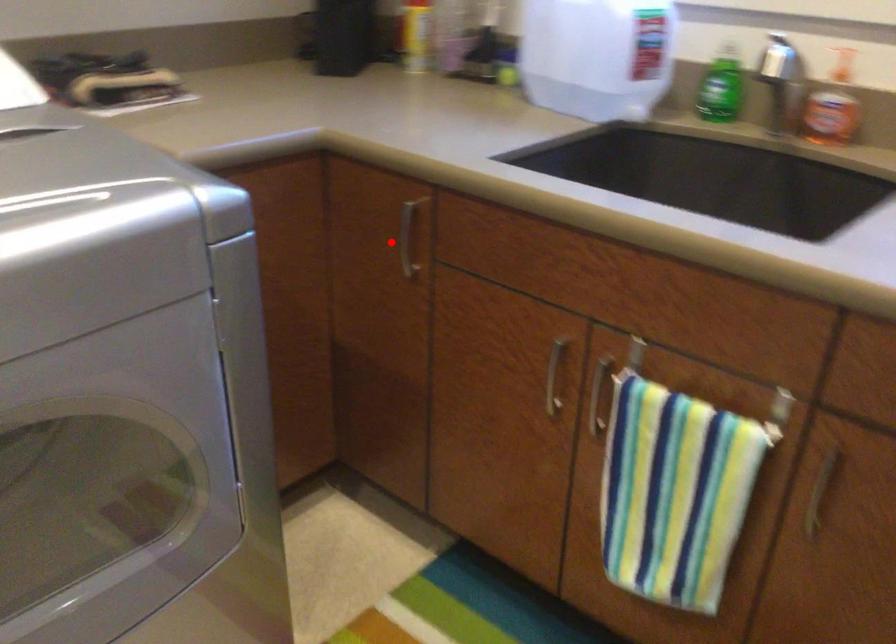
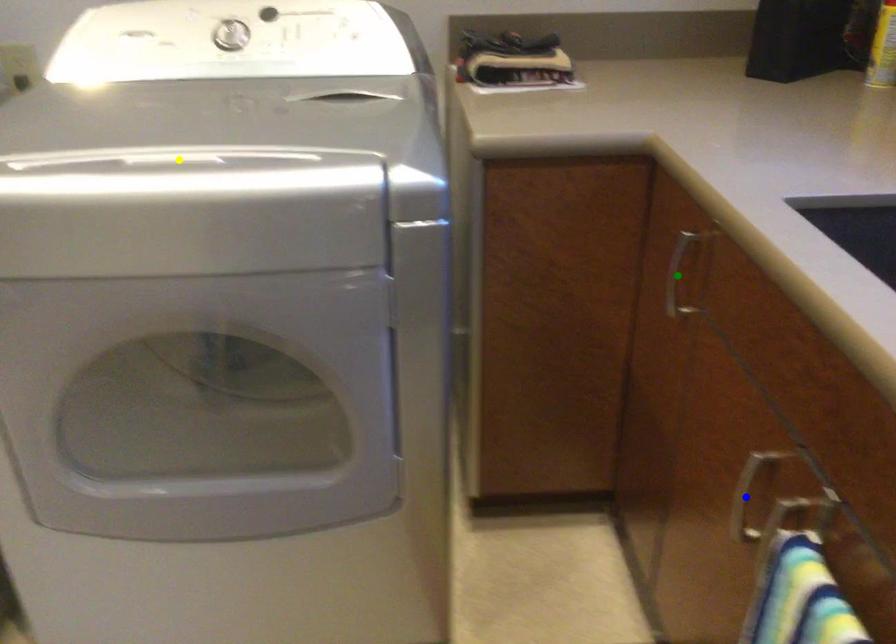
Question: I am providing you with two images of the same scene from different viewpoints. A red point is marked on the first image. You are given multiple points on the second image. Which mark in image 2 goes with the point in image 1?

Choices:
 (A) blue point
 (B) green point
 (C) yellow point

Answer: (B)